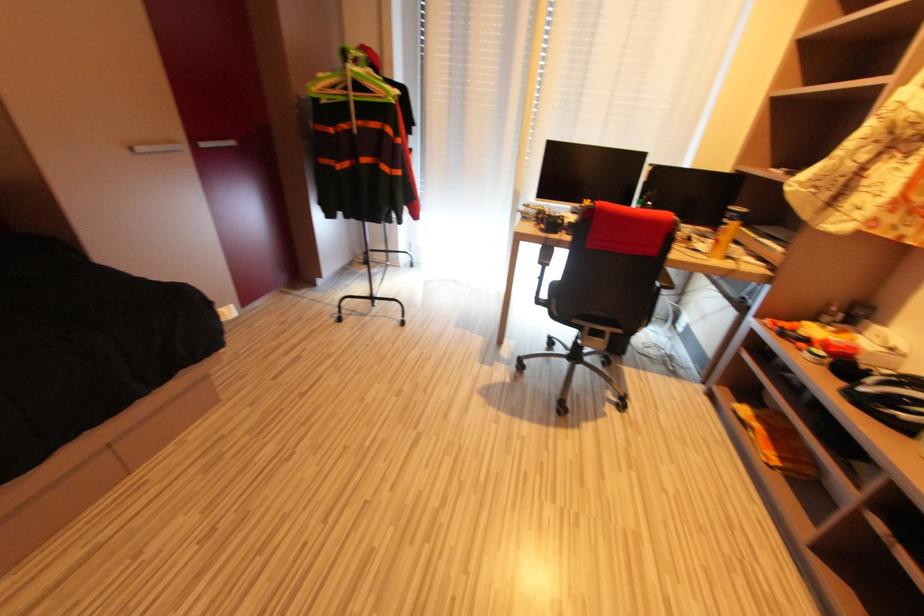
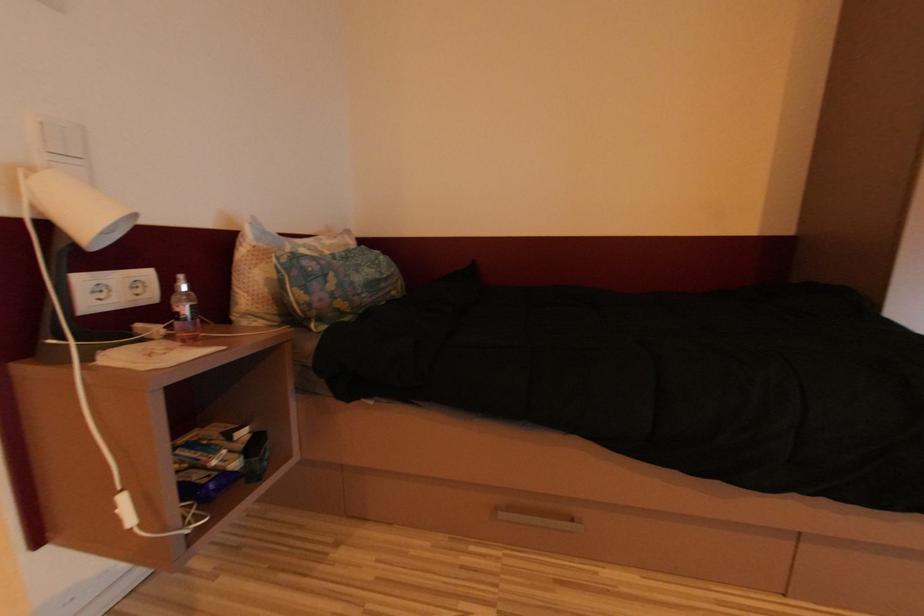
Question: How did the camera likely rotate?

Choices:
 (A) Left
 (B) Right
 (C) Up
 (D) Down

Answer: (A)